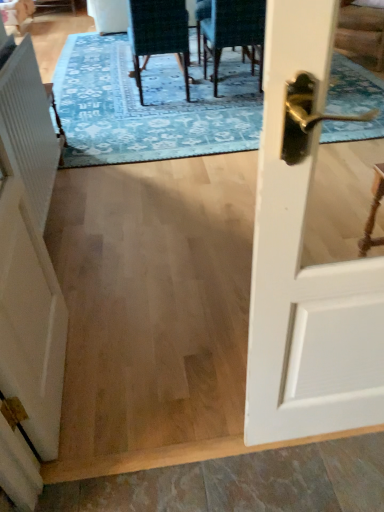
Question: Is velvet dark green chair at upper center, the 2th chair when ordered from left to right, surrounding white matte barn door at left?

Choices:
 (A) yes
 (B) no

Answer: (B)

Question: Can you confirm if velvet dark green chair at upper center, the 2th chair when ordered from left to right, is bigger than white matte barn door at left?

Choices:
 (A) no
 (B) yes

Answer: (B)

Question: Considering the relative sizes of velvet dark green chair at upper center, the 1th chair from the right, and white matte barn door at left in the image provided, is velvet dark green chair at upper center, the 1th chair from the right, taller than white matte barn door at left?

Choices:
 (A) yes
 (B) no

Answer: (B)

Question: Is velvet dark green chair at upper center, the 1th chair from the right, not close to white matte barn door at left?

Choices:
 (A) yes
 (B) no

Answer: (A)

Question: From the image's perspective, is velvet dark green chair at upper center, the 1th chair from the right, located beneath white matte barn door at left?

Choices:
 (A) no
 (B) yes

Answer: (A)

Question: From a real-world perspective, relative to white ribbed radiator at left, is velvet dark green chair at upper center, the 1th chair from the right, vertically above or below?

Choices:
 (A) below
 (B) above

Answer: (A)

Question: Considering the positions of point (244, 1) and point (41, 184), is point (244, 1) closer or farther from the camera than point (41, 184)?

Choices:
 (A) farther
 (B) closer

Answer: (A)

Question: Is velvet dark green chair at upper center, the 2th chair when ordered from left to right, wider or thinner than white ribbed radiator at left?

Choices:
 (A) thin
 (B) wide

Answer: (B)

Question: Considering the positions of velvet dark green chair at upper center, the 1th chair from the right, and white ribbed radiator at left in the image, is velvet dark green chair at upper center, the 1th chair from the right, taller or shorter than white ribbed radiator at left?

Choices:
 (A) short
 (B) tall

Answer: (B)

Question: Would you say white glossy door handle at right is inside or outside white ribbed radiator at left?

Choices:
 (A) outside
 (B) inside

Answer: (A)

Question: Considering the positions of white glossy door handle at right and white ribbed radiator at left in the image, is white glossy door handle at right wider or thinner than white ribbed radiator at left?

Choices:
 (A) thin
 (B) wide

Answer: (B)

Question: Is point (292, 210) positioned closer to the camera than point (21, 52)?

Choices:
 (A) farther
 (B) closer

Answer: (B)

Question: From a real-world perspective, relative to white ribbed radiator at left, is white glossy door handle at right vertically above or below?

Choices:
 (A) above
 (B) below

Answer: (A)

Question: Looking at their shapes, would you say blue textured rug at center is wider or thinner than velvet dark green chair at center, the 2th chair viewed from the right?

Choices:
 (A) thin
 (B) wide

Answer: (B)

Question: Is blue textured rug at center inside or outside of velvet dark green chair at center, the 2th chair viewed from the right?

Choices:
 (A) inside
 (B) outside

Answer: (B)